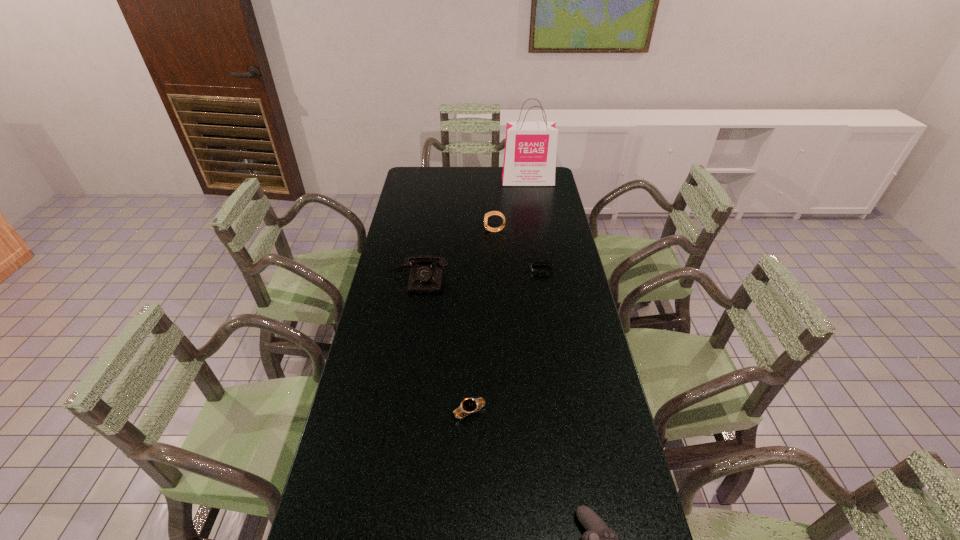
In order to click on vacant area that lies between the taller watch and the shorter watch in this screenshot , I will do `click(482, 321)`.

Image resolution: width=960 pixels, height=540 pixels. What are the coordinates of `object that is the third nearest to the farthest object` in the screenshot? It's located at (425, 278).

Identify which object is located as the fourth nearest to the wristband. Please provide its 2D coordinates. Your answer should be formatted as a tuple, i.e. [(x, y)], where the tuple contains the x and y coordinates of a point satisfying the conditions above.

[(530, 147)]

Image resolution: width=960 pixels, height=540 pixels. Identify the location of vacant space that satisfies the following two spatial constraints: 1. on the front-facing side of the tallest object; 2. on the face of the fifth nearest object. click(x=537, y=231).

Where is `free space that satisfies the following two spatial constraints: 1. on the front-facing side of the tallest object; 2. on the display of the shortest object`? This screenshot has height=540, width=960. free space that satisfies the following two spatial constraints: 1. on the front-facing side of the tallest object; 2. on the display of the shortest object is located at coordinates (542, 269).

Identify the location of vacant space that satisfies the following two spatial constraints: 1. on the display of the shortest object; 2. on the front side of the second shortest object. The height and width of the screenshot is (540, 960). (565, 412).